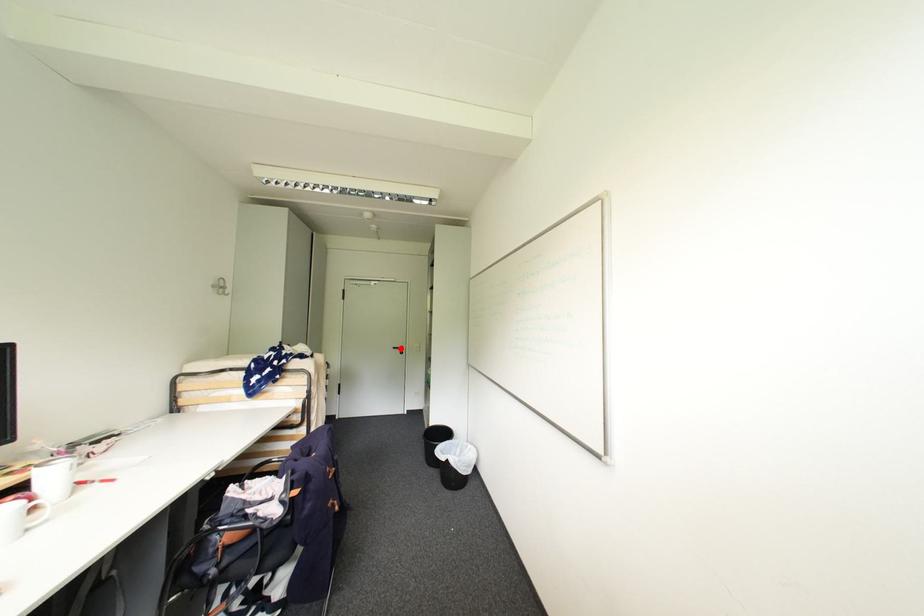
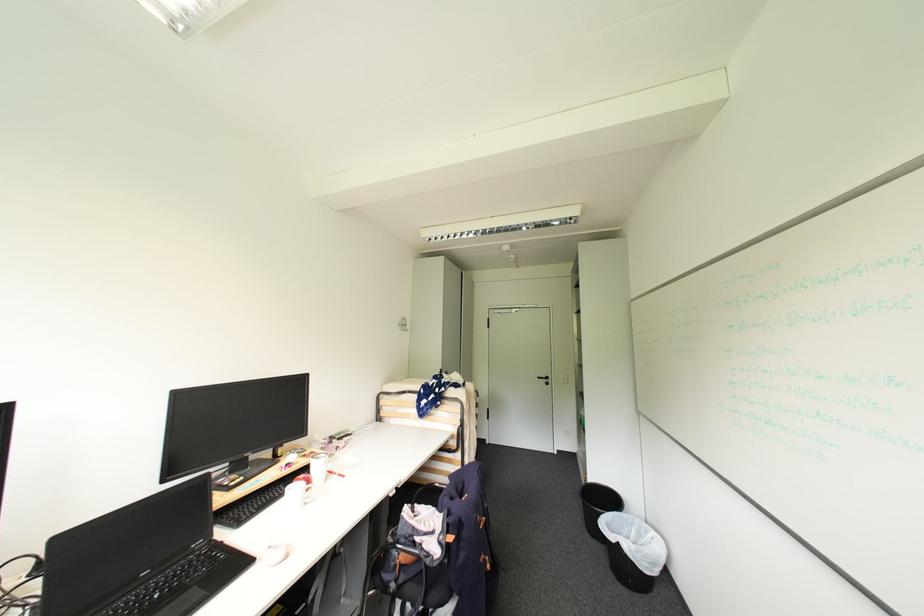
Question: I am providing you with two images of the same scene from different viewpoints. A red point is shown in image1. For the corresponding object point in image2, is it positioned nearer or farther from the camera?

Choices:
 (A) Nearer
 (B) Farther

Answer: (A)